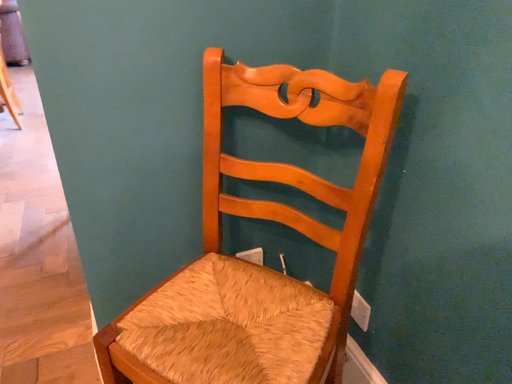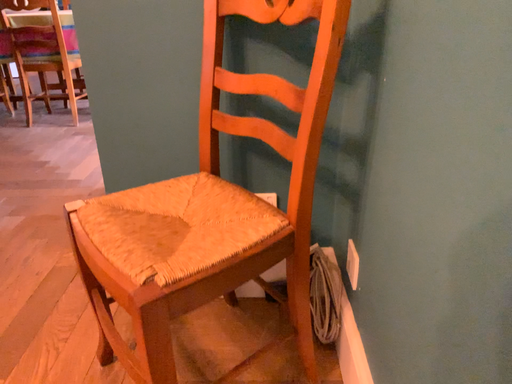
Question: How did the camera likely rotate when shooting the video?

Choices:
 (A) rotated left
 (B) rotated right

Answer: (A)